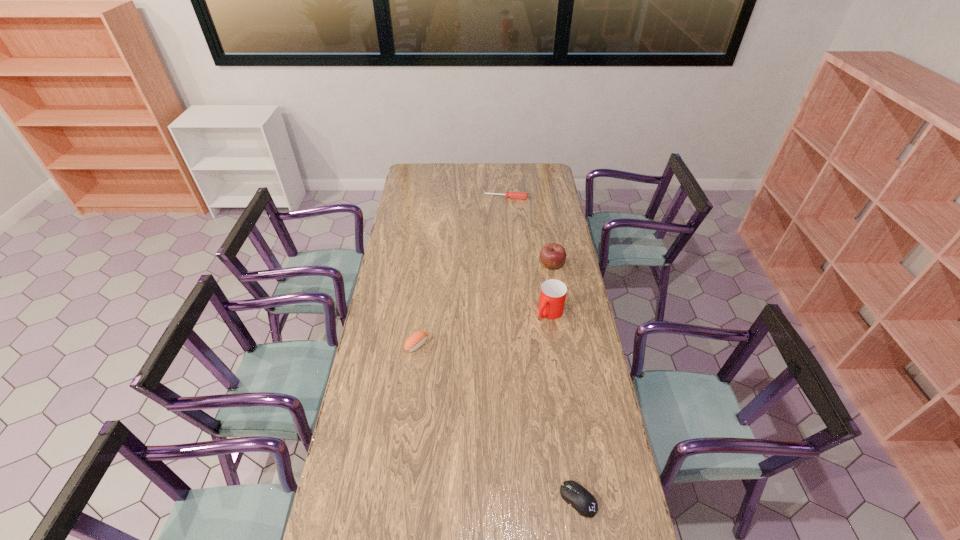
This screenshot has width=960, height=540. I want to click on object that is positioned at the left edge, so click(x=417, y=339).

Find the location of a particular element. computer equipment positioned at the right edge is located at coordinates (574, 494).

At what (x,y) coordinates should I click in order to perform the action: click on cup that is at the right edge. Please return your answer as a coordinate pair (x, y). The height and width of the screenshot is (540, 960). Looking at the image, I should click on (553, 293).

Where is `apple located in the right edge section of the desktop`? The height and width of the screenshot is (540, 960). apple located in the right edge section of the desktop is located at coordinates (552, 255).

You are a GUI agent. You are given a task and a screenshot of the screen. Output one action in this format:
    pyautogui.click(x=<x>, y=<y>)
    Task: Click on the object situated at the near right corner
    This screenshot has width=960, height=540.
    Given the screenshot: What is the action you would take?
    pyautogui.click(x=574, y=494)

Find the location of `vacant space at the far edge of the desktop`. vacant space at the far edge of the desktop is located at coordinates (435, 177).

You are a GUI agent. You are given a task and a screenshot of the screen. Output one action in this format:
    pyautogui.click(x=<x>, y=<y>)
    Task: Click on the free region at the left edge
    This screenshot has height=540, width=960.
    Given the screenshot: What is the action you would take?
    pos(358,460)

Locate an element on the screen. This screenshot has height=540, width=960. free space at the right edge of the desktop is located at coordinates (552, 185).

The width and height of the screenshot is (960, 540). In the image, there is a desktop. Find the location of `vacant space at the far left corner`. vacant space at the far left corner is located at coordinates (409, 172).

Locate an element on the screen. Image resolution: width=960 pixels, height=540 pixels. vacant space at the far right corner of the desktop is located at coordinates (543, 180).